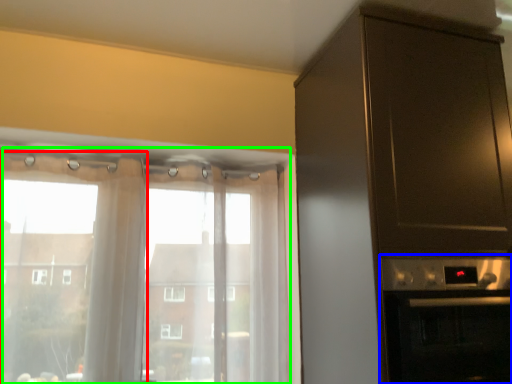
Question: Considering the real-world distances, which object is farthest from curtain (highlighted by a red box)? appliance (highlighted by a blue box) or window (highlighted by a green box)?

Choices:
 (A) appliance
 (B) window

Answer: (A)